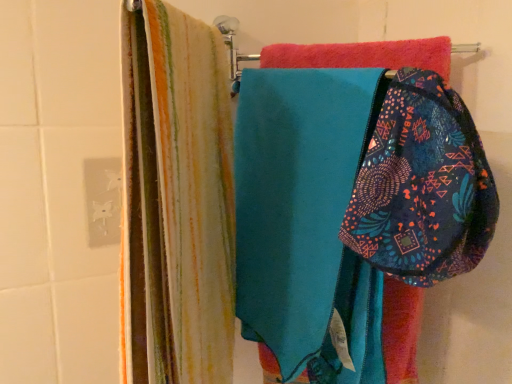
The width and height of the screenshot is (512, 384). I want to click on teal fabric at center, so click(x=141, y=188).

What do you see at coordinates (141, 188) in the screenshot? I see `teal fabric at center` at bounding box center [141, 188].

The height and width of the screenshot is (384, 512). What are the coordinates of `patterned fabric pouch at center` in the screenshot? It's located at (422, 186).

The width and height of the screenshot is (512, 384). Describe the element at coordinates (422, 186) in the screenshot. I see `patterned fabric pouch at center` at that location.

You are a GUI agent. You are given a task and a screenshot of the screen. Output one action in this format:
    pyautogui.click(x=<x>, y=<y>)
    Task: Click on the teal fabric at center
    This screenshot has width=512, height=384.
    Given the screenshot: What is the action you would take?
    pyautogui.click(x=141, y=188)

Does patterned fabric pouch at center appear on the right side of teal fabric at center?

Indeed, patterned fabric pouch at center is positioned on the right side of teal fabric at center.

Is patterned fabric pouch at center in front of or behind teal fabric at center in the image?

patterned fabric pouch at center is in front of teal fabric at center.

Which is in front, point (484, 206) or point (202, 90)?

The point (484, 206) is in front.

From the image's perspective, is patterned fabric pouch at center on top of teal fabric at center?

Correct, patterned fabric pouch at center appears higher than teal fabric at center in the image.

From a real-world perspective, is patterned fabric pouch at center located beneath teal fabric at center?

No.

Is patterned fabric pouch at center wider than teal fabric at center?

A: No, patterned fabric pouch at center is not wider than teal fabric at center.

Looking at this image, between patterned fabric pouch at center and teal fabric at center, which one has less height?

patterned fabric pouch at center is shorter.

Considering the relative sizes of patterned fabric pouch at center and teal fabric at center in the image provided, is patterned fabric pouch at center bigger than teal fabric at center?

No, patterned fabric pouch at center is not bigger than teal fabric at center.

Is teal fabric at center surrounded by patterned fabric pouch at center?

No, teal fabric at center is located outside of patterned fabric pouch at center.

In the scene shown: Can you see patterned fabric pouch at center touching teal fabric at center?

No, patterned fabric pouch at center is not in contact with teal fabric at center.

Is patterned fabric pouch at center facing away from teal fabric at center?

Yes.

What's the angular difference between patterned fabric pouch at center and teal fabric at center's facing directions?

There is a 12.1-degree angle between the facing directions of patterned fabric pouch at center and teal fabric at center.

The height and width of the screenshot is (384, 512). Find the location of `pouch lying in front of the teal fabric at center`. pouch lying in front of the teal fabric at center is located at coordinates (422, 186).

Based on their positions, is teal fabric at center located to the left or right of patterned fabric pouch at center?

Clearly, teal fabric at center is on the left of patterned fabric pouch at center in the image.

Who is more distant, teal fabric at center or patterned fabric pouch at center?

Positioned behind is teal fabric at center.

Is point (169, 166) positioned before point (362, 250)?

That is True.

From the image's perspective, which is below, teal fabric at center or patterned fabric pouch at center?

teal fabric at center appears lower in the image.

From a real-world perspective, which object rests below the other?

teal fabric at center is physically lower.

Does teal fabric at center have a greater width compared to patterned fabric pouch at center?

Yes.

Between teal fabric at center and patterned fabric pouch at center, which one has more height?

teal fabric at center.

Is teal fabric at center smaller than patterned fabric pouch at center?

No.

Is teal fabric at center positioned beyond the bounds of patterned fabric pouch at center?

Yes, teal fabric at center is outside of patterned fabric pouch at center.

Is teal fabric at center next to patterned fabric pouch at center?

No, teal fabric at center is not in contact with patterned fabric pouch at center.

Could you tell me if teal fabric at center is facing patterned fabric pouch at center?

Yes, teal fabric at center is turned towards patterned fabric pouch at center.

How different are the orientations of teal fabric at center and patterned fabric pouch at center in degrees?

12.1 degrees.

At what (x,y) coordinates should I click in order to perform the action: click on laundry behind the patterned fabric pouch at center. Please return your answer as a coordinate pair (x, y). The image size is (512, 384). Looking at the image, I should click on (141, 188).

The width and height of the screenshot is (512, 384). I want to click on pouch on the right side of teal fabric at center, so click(x=422, y=186).

This screenshot has width=512, height=384. I want to click on laundry that is on the left side of patterned fabric pouch at center, so click(141, 188).